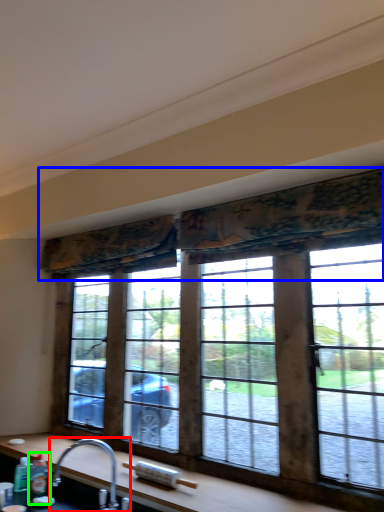
Question: Which object is positioned closest to tap (highlighted by a red box)? Select from curtain (highlighted by a blue box) and bottle (highlighted by a green box).

Choices:
 (A) curtain
 (B) bottle

Answer: (B)